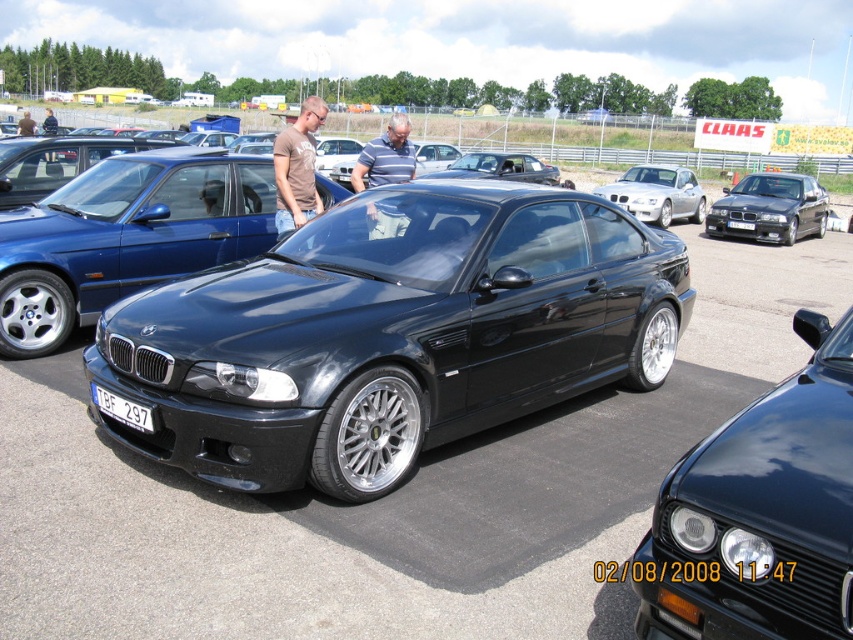
Between glossy black sedan at center and glossy black car at center, which one is positioned lower?

glossy black sedan at center

Who is higher up, glossy black sedan at center or glossy black car at center?

glossy black car at center is above.

Identify the location of glossy black sedan at center. The width and height of the screenshot is (853, 640). (759, 513).

Is glossy black car at center to the right of brown cotton t-shirt at center from the viewer's perspective?

Incorrect, glossy black car at center is not on the right side of brown cotton t-shirt at center.

Is point (247, 186) less distant than point (274, 156)?

No, (247, 186) is further to viewer.

Between point (111, 262) and point (283, 211), which one is positioned in front?

Positioned in front is point (111, 262).

I want to click on glossy black car at center, so click(x=125, y=237).

From the picture: Between satin silver metallic coupe at center and satin black car at center, which one has less height?

With less height is satin silver metallic coupe at center.

How far apart are satin silver metallic coupe at center and satin black car at center?

They are 3.20 meters apart.

Who is more forward, (x=674, y=180) or (x=473, y=157)?

Positioned in front is point (x=473, y=157).

At what (x,y) coordinates should I click in order to perform the action: click on satin silver metallic coupe at center. Please return your answer as a coordinate pair (x, y). Looking at the image, I should click on (657, 193).